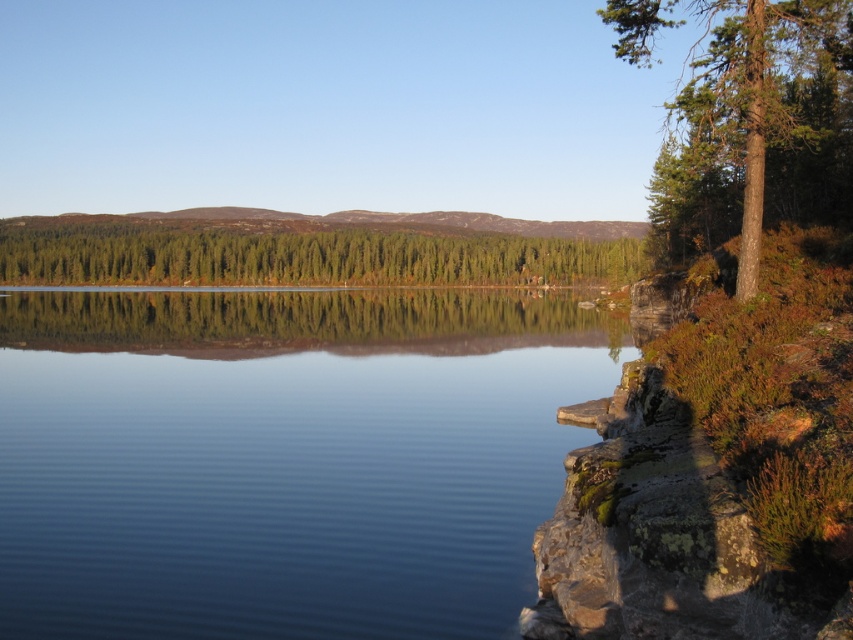
Question: Is clear water at center wider than brown textured tree at right?

Choices:
 (A) yes
 (B) no

Answer: (B)

Question: Which of the following is the farthest from the observer?

Choices:
 (A) brown textured tree at right
 (B) clear water at center
 (C) green matte forest at center

Answer: (C)

Question: Which object is farther from the camera taking this photo?

Choices:
 (A) brown textured tree at right
 (B) clear water at center
 (C) green matte forest at center

Answer: (C)

Question: Does clear water at center appear under brown textured tree at right?

Choices:
 (A) no
 (B) yes

Answer: (B)

Question: Can you confirm if brown textured tree at right is thinner than green matte forest at center?

Choices:
 (A) no
 (B) yes

Answer: (B)

Question: Which is farther from the clear water at center?

Choices:
 (A) green matte forest at center
 (B) brown textured tree at right

Answer: (A)